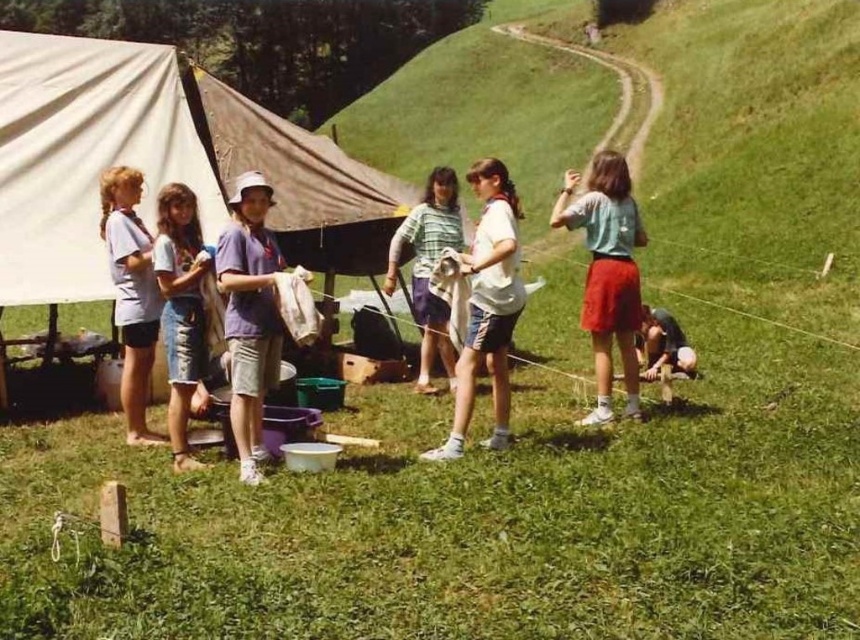
Question: Is white cotton shirt at center to the right of dark gray fabric at lower right from the viewer's perspective?

Choices:
 (A) yes
 (B) no

Answer: (B)

Question: Which of the following is the farthest from the observer?

Choices:
 (A) (670, 358)
 (B) (441, 339)
 (C) (489, 269)

Answer: (A)

Question: Estimate the real-world distances between objects in this image. Which object is farther from the light blue t-shirt at center?

Choices:
 (A) purple cotton shirt at center
 (B) white cotton shirt at center
 (C) white cotton shirt at left
 (D) denim shorts at center

Answer: (C)

Question: Can you confirm if white canvas tent at left is positioned to the right of white cotton shirt at center?

Choices:
 (A) no
 (B) yes

Answer: (A)

Question: Which of the following is the closest to the observer?

Choices:
 (A) (593, 168)
 (B) (20, 65)

Answer: (A)

Question: From the image, what is the correct spatial relationship of light blue t-shirt at center in relation to white cotton shirt at center?

Choices:
 (A) above
 (B) below

Answer: (A)